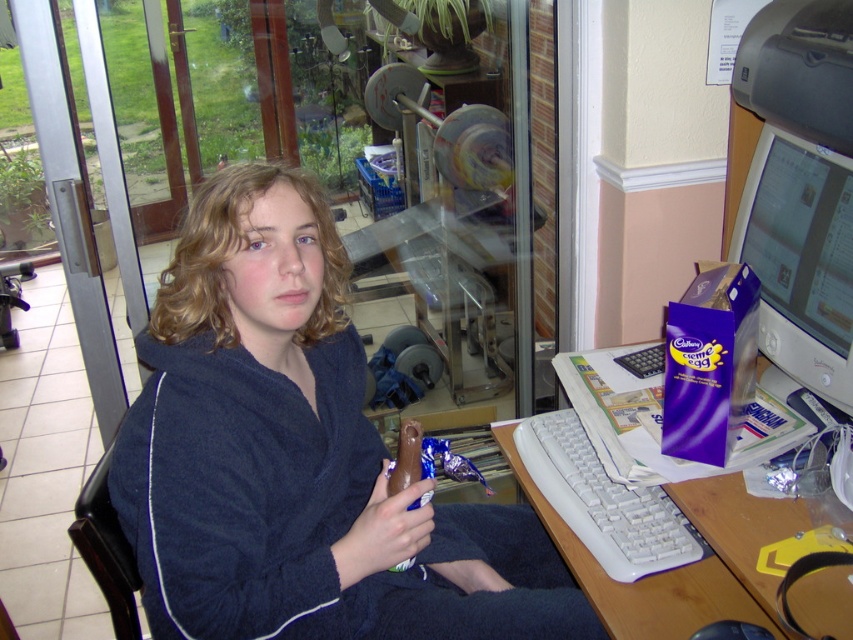
You are a delivery person who needs to place a package on the desk. The package is 10 cm tall. The desk has limited space between the dark blue plush robe at center and the matte plastic computer monitor at right. Can the package fit vertically between them?

The dark blue plush robe at center is below the matte plastic computer monitor at right, so there is vertical space between them. Since the package is only 10 cm tall, it should fit vertically between the dark blue plush robe at center and the matte plastic computer monitor at right.

Consider the image. You are standing in front of the desk and want to place a new item between the dark blue plush robe at center and the matte plastic computer monitor at right. Which object should you place it closer to if you want the item to be nearer to the viewer?

You should place the new item closer to the dark blue plush robe at center because it is closer to the viewer than the matte plastic computer monitor at right.

You are a delivery person who needs to place a package on the desk without disturbing the dark blue plush robe at center or the white plastic keyboard at right. Where should you place the package?

The white plastic keyboard at right is behind the dark blue plush robe at center, so placing the package on the desk in front of the dark blue plush robe at center would avoid disturbing both items.